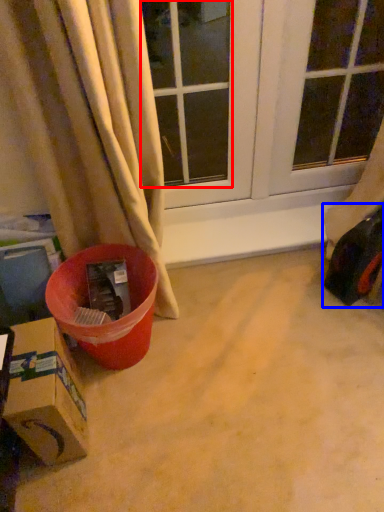
Question: Which point is closer to the camera, window (highlighted by a red box) or toy car (highlighted by a blue box)?

Choices:
 (A) window
 (B) toy car

Answer: (A)